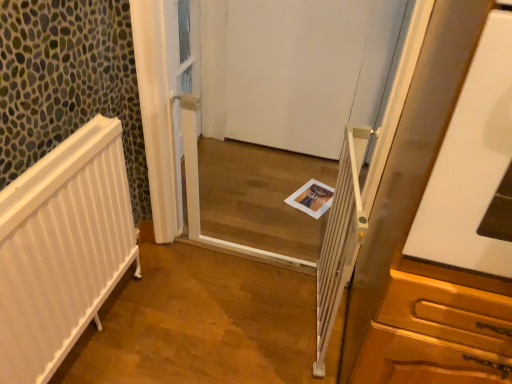
Locate an element on the screen. vacant region to the right of white matte radiator at left is located at coordinates (182, 331).